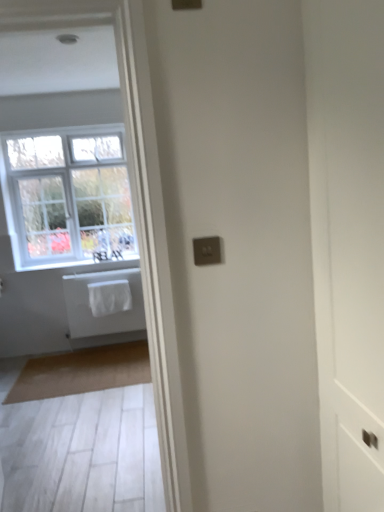
Identify the location of free location above white matte towel at left (from a real-world perspective). The width and height of the screenshot is (384, 512). (x=93, y=266).